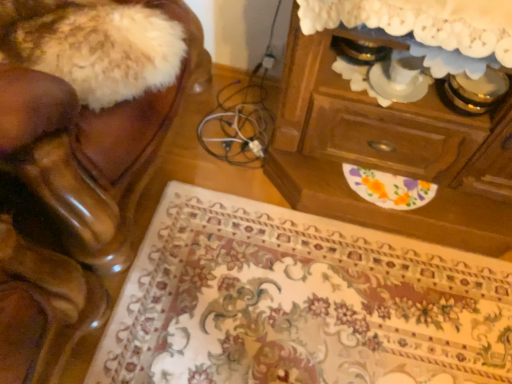
In order to face wooden chest of drawers at upper right, should I rotate leftwards or rightwards?

Rotate your view right by about 22.695°.

This screenshot has width=512, height=384. Describe the element at coordinates (80, 159) in the screenshot. I see `shiny brown leather chair at left` at that location.

The height and width of the screenshot is (384, 512). I want to click on wooden chest of drawers at upper right, so tap(386, 153).

Considering the sizes of objects floral carpet at lower center and shiny brown leather chair at left in the image provided, who is thinner, floral carpet at lower center or shiny brown leather chair at left?

With smaller width is shiny brown leather chair at left.

Based on the photo, is shiny brown leather chair at left inside floral carpet at lower center?

No.

How many degrees apart are the facing directions of floral carpet at lower center and shiny brown leather chair at left?

There is a 89.3-degree angle between the facing directions of floral carpet at lower center and shiny brown leather chair at left.

From a real-world perspective, which object rests below the other?

In real-world perspective, floral carpet at lower center is lower.

Is floral carpet at lower center bigger than wooden chest of drawers at upper right?

Actually, floral carpet at lower center might be smaller than wooden chest of drawers at upper right.

From a real-world perspective, which is physically below, floral carpet at lower center or wooden chest of drawers at upper right?

floral carpet at lower center is physically lower.

Which of these two, floral carpet at lower center or wooden chest of drawers at upper right, is thinner?

With smaller width is wooden chest of drawers at upper right.

Could you tell me if floral carpet at lower center is turned towards wooden chest of drawers at upper right?

No.

Looking at this image, can you confirm if shiny brown leather chair at left is shorter than floral carpet at lower center?

No.

How many degrees apart are the facing directions of shiny brown leather chair at left and floral carpet at lower center?

There is a 89.3-degree angle between the facing directions of shiny brown leather chair at left and floral carpet at lower center.

Measure the distance from shiny brown leather chair at left to floral carpet at lower center.

They are 18.17 inches apart.

Is floral carpet at lower center a part of shiny brown leather chair at left?

No, floral carpet at lower center is not a part of shiny brown leather chair at left.

What's the angular difference between wooden chest of drawers at upper right and shiny brown leather chair at left's facing directions?

There is a 90-degree angle between the facing directions of wooden chest of drawers at upper right and shiny brown leather chair at left.

Is wooden chest of drawers at upper right facing away from shiny brown leather chair at left?

That's not correct — wooden chest of drawers at upper right is not looking away from shiny brown leather chair at left.

Is point (333, 134) positioned after point (72, 282)?

Yes, it is behind point (72, 282).

Find the location of a particular element. This screenshot has height=384, width=512. mat below the wooden chest of drawers at upper right (from the image's perspective) is located at coordinates (300, 302).

Relative to floral carpet at lower center, is wooden chest of drawers at upper right in front or behind?

Clearly, wooden chest of drawers at upper right is in front of floral carpet at lower center.

Looking at this image, how distant is wooden chest of drawers at upper right from floral carpet at lower center?

They are 11.38 inches apart.

Between wooden chest of drawers at upper right and floral carpet at lower center, which one has smaller width?

With smaller width is wooden chest of drawers at upper right.

In the image, is shiny brown leather chair at left positioned in front of or behind wooden chest of drawers at upper right?

Clearly, shiny brown leather chair at left is in front of wooden chest of drawers at upper right.

Between shiny brown leather chair at left and wooden chest of drawers at upper right, which one appears on the left side from the viewer's perspective?

From the viewer's perspective, shiny brown leather chair at left appears more on the left side.

Is shiny brown leather chair at left thinner than wooden chest of drawers at upper right?

In fact, shiny brown leather chair at left might be wider than wooden chest of drawers at upper right.

Find the location of `the chest of drawers lying behind the shiny brown leather chair at left`. the chest of drawers lying behind the shiny brown leather chair at left is located at coordinates (386, 153).

Image resolution: width=512 pixels, height=384 pixels. Find the location of `furniture in front of the floral carpet at lower center`. furniture in front of the floral carpet at lower center is located at coordinates click(x=80, y=159).

The image size is (512, 384). What are the coordinates of `mat to the left of wooden chest of drawers at upper right` in the screenshot? It's located at (300, 302).

Which object lies further to the anchor point shiny brown leather chair at left, floral carpet at lower center or wooden chest of drawers at upper right?

wooden chest of drawers at upper right.

Estimate the real-world distances between objects in this image. Which object is further from floral carpet at lower center, wooden chest of drawers at upper right or shiny brown leather chair at left?

Based on the image, shiny brown leather chair at left appears to be further to floral carpet at lower center.

When comparing their distances from wooden chest of drawers at upper right, does shiny brown leather chair at left or floral carpet at lower center seem further?

shiny brown leather chair at left is positioned further to the anchor wooden chest of drawers at upper right.

When comparing their distances from shiny brown leather chair at left, does wooden chest of drawers at upper right or floral carpet at lower center seem further?

wooden chest of drawers at upper right is positioned further to the anchor shiny brown leather chair at left.

When comparing their distances from wooden chest of drawers at upper right, does floral carpet at lower center or shiny brown leather chair at left seem closer?

Among the two, floral carpet at lower center is located nearer to wooden chest of drawers at upper right.

Which object lies further to the anchor point floral carpet at lower center, shiny brown leather chair at left or wooden chest of drawers at upper right?

Based on the image, shiny brown leather chair at left appears to be further to floral carpet at lower center.

Where is `mat situated between shiny brown leather chair at left and wooden chest of drawers at upper right from left to right`? The image size is (512, 384). mat situated between shiny brown leather chair at left and wooden chest of drawers at upper right from left to right is located at coordinates (300, 302).